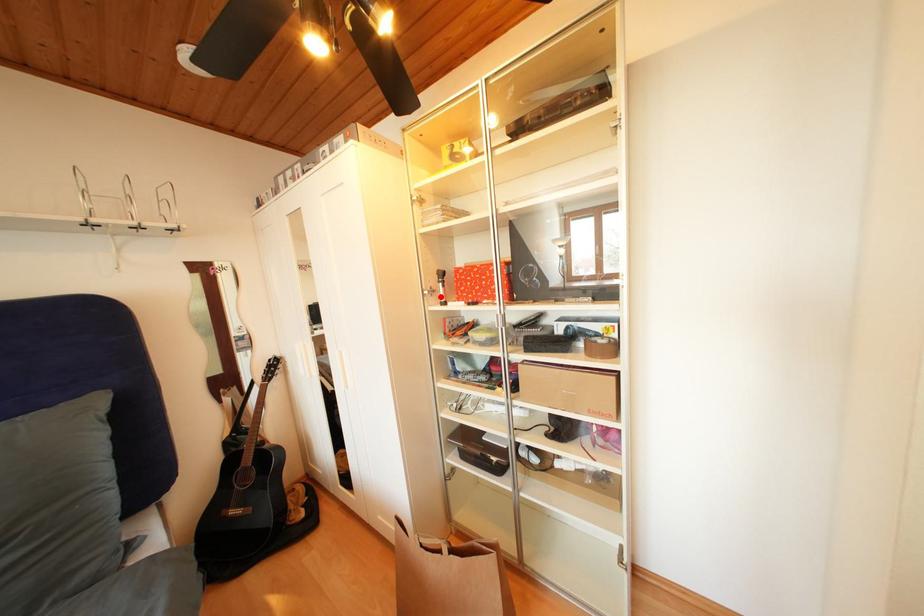
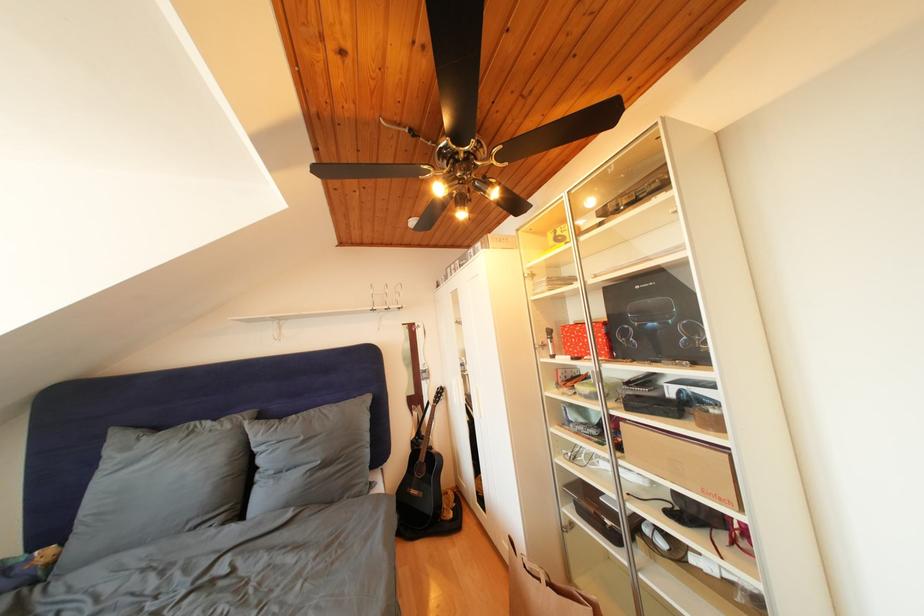
Locate, in the second image, the point that corresponds to the highlighted location in the first image.

(552, 351)